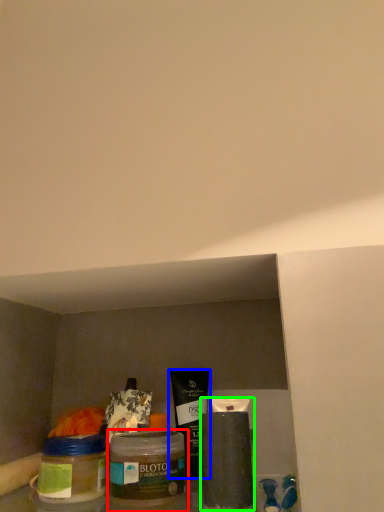
Question: Estimate the real-world distances between objects in this image. Which object is closer to glass jar (highlighted by a red box), product (highlighted by a blue box) or cleaning product (highlighted by a green box)?

Choices:
 (A) product
 (B) cleaning product

Answer: (B)